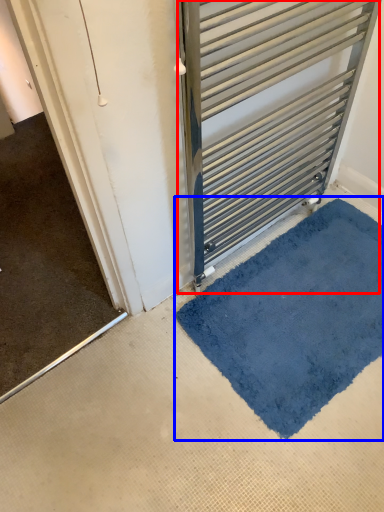
Question: Among these objects, which one is nearest to the camera, door (highlighted by a red box) or bath mat (highlighted by a blue box)?

Choices:
 (A) door
 (B) bath mat

Answer: (A)